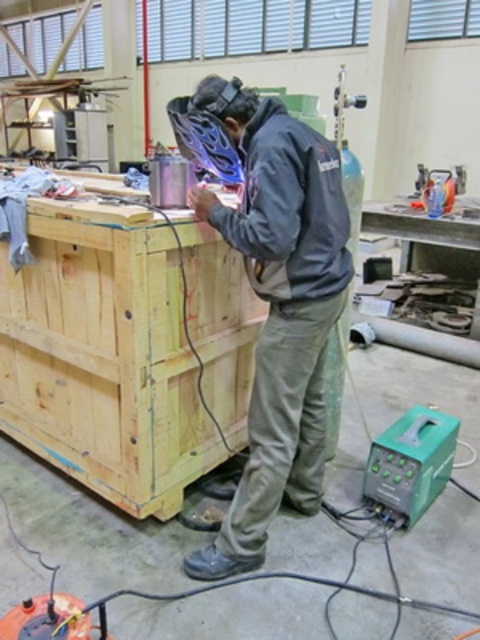
Question: Does yellow wood crate at center appear on the left side of blue metallic helmet at center?

Choices:
 (A) no
 (B) yes

Answer: (B)

Question: Does yellow wood crate at center appear on the left side of blue metallic helmet at center?

Choices:
 (A) no
 (B) yes

Answer: (B)

Question: Which point appears closest to the camera in this image?

Choices:
 (A) (97, 403)
 (B) (323, 253)

Answer: (B)

Question: Can you confirm if yellow wood crate at center is positioned to the right of dark gray jacket at center?

Choices:
 (A) no
 (B) yes

Answer: (A)

Question: Which of the following is the closest to the observer?

Choices:
 (A) blue metallic helmet at center
 (B) dark gray jacket at center
 (C) yellow wood crate at center

Answer: (B)

Question: Which of the following is the farthest from the observer?

Choices:
 (A) blue metallic helmet at center
 (B) dark gray jacket at center

Answer: (A)